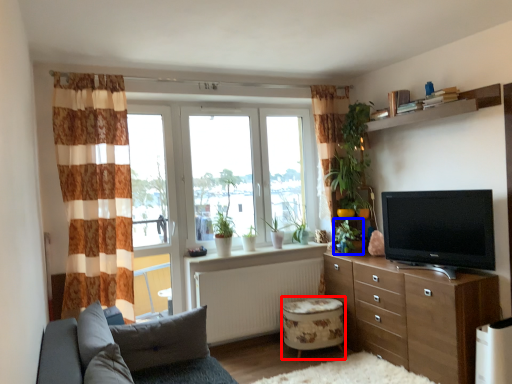
Question: Which object appears farthest to the camera in this image, stool (highlighted by a red box) or plant (highlighted by a blue box)?

Choices:
 (A) stool
 (B) plant

Answer: (B)